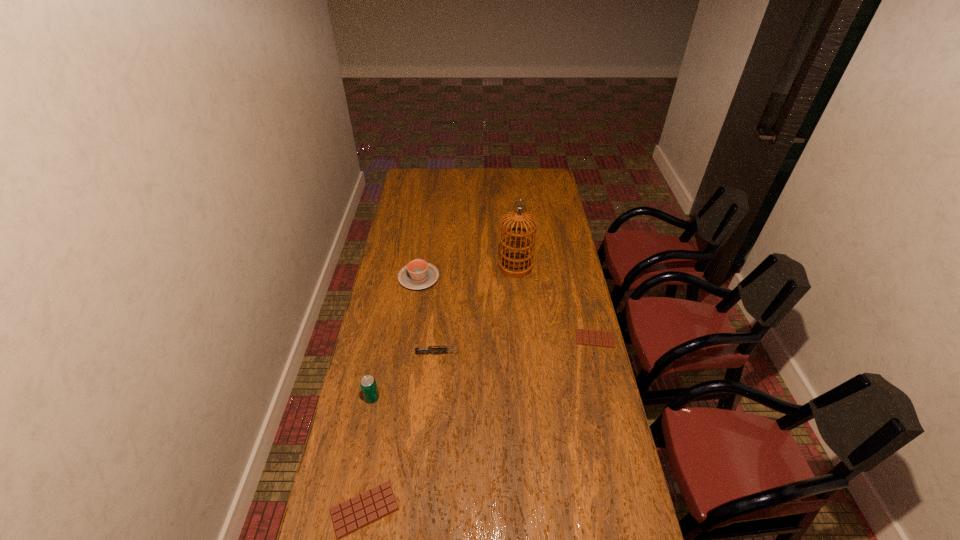
Locate an element on the screen. vacant space at the near edge of the desktop is located at coordinates (540, 514).

The image size is (960, 540). I want to click on vacant space at the left edge of the desktop, so click(361, 394).

Identify the location of free location at the right edge. The height and width of the screenshot is (540, 960). (549, 262).

Find the location of a particular element. This screenshot has height=540, width=960. vacant space at the far right corner of the desktop is located at coordinates (535, 180).

Find the location of a particular element. This screenshot has height=540, width=960. blank region between the gun and the fifth shortest object is located at coordinates (405, 376).

Locate an element on the screen. The image size is (960, 540). vacant area between the shorter candy bar and the fourth shortest object is located at coordinates (507, 308).

The height and width of the screenshot is (540, 960). In order to click on free point between the chinaware and the fourth tallest object in this screenshot , I will do point(428,316).

I want to click on unoccupied area between the farther candy bar and the fifth shortest object, so click(x=484, y=368).

You are a GUI agent. You are given a task and a screenshot of the screen. Output one action in this format:
    pyautogui.click(x=<x>, y=<y>)
    Task: Click on the empty space between the farther candy bar and the fourth shortest object
    The image size is (960, 540).
    Given the screenshot: What is the action you would take?
    pyautogui.click(x=507, y=308)

Identify the location of free point between the third tallest object and the right candy bar. (507, 308).